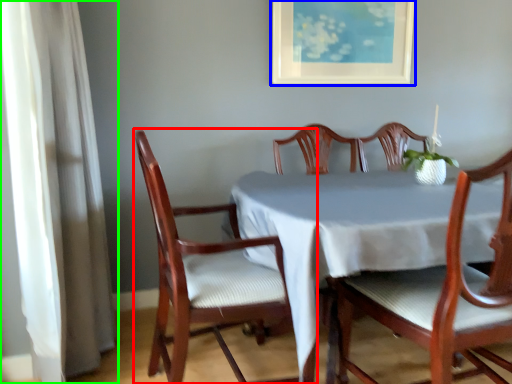
Question: Estimate the real-world distances between objects in this image. Which object is closer to chair (highlighted by a red box), picture frame (highlighted by a blue box) or curtain (highlighted by a green box)?

Choices:
 (A) picture frame
 (B) curtain

Answer: (B)